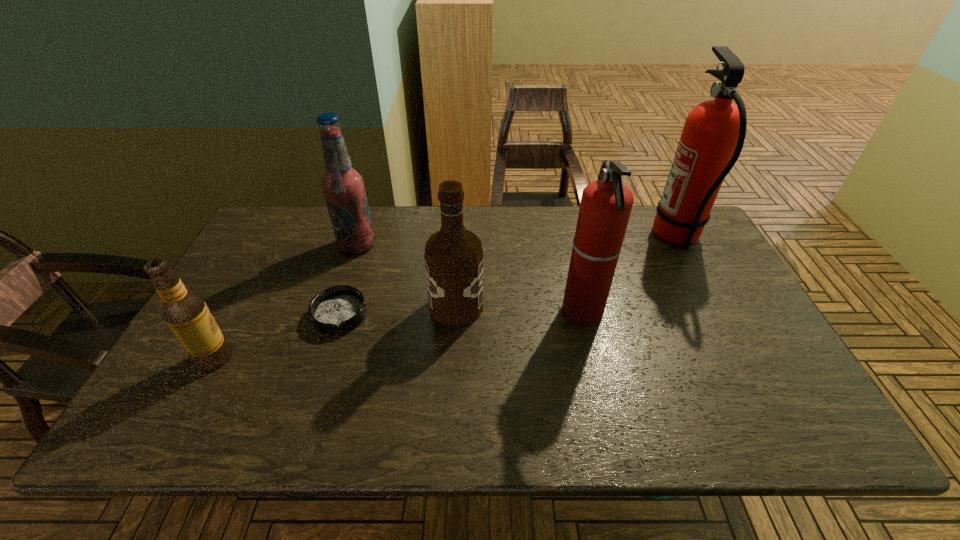
Find the location of `the farther fire extinguisher`. the farther fire extinguisher is located at coordinates (712, 139).

Where is `the right fire extinguisher`? The height and width of the screenshot is (540, 960). the right fire extinguisher is located at coordinates (712, 139).

Locate an element on the screen. the shorter fire extinguisher is located at coordinates (606, 204).

Find the location of `the left fire extinguisher`. the left fire extinguisher is located at coordinates (606, 204).

Where is `the farthest alcohol`? the farthest alcohol is located at coordinates (343, 187).

I want to click on the second nearest alcohol, so click(453, 257).

Where is `the fourth object from left to right`? Image resolution: width=960 pixels, height=540 pixels. the fourth object from left to right is located at coordinates (453, 257).

Where is `the shortest alcohol`? This screenshot has height=540, width=960. the shortest alcohol is located at coordinates (184, 310).

Locate an element on the screen. This screenshot has height=540, width=960. the nearest alcohol is located at coordinates (184, 310).

Locate an element on the screen. the shortest object is located at coordinates (339, 309).